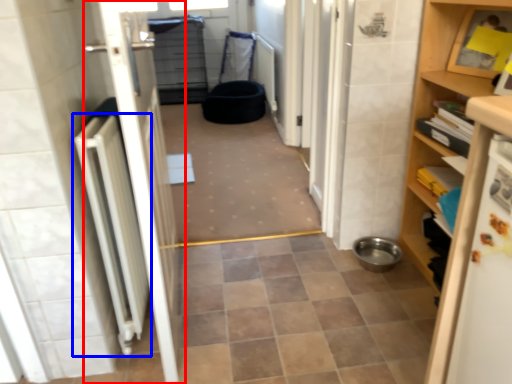
Question: Among these objects, which one is farthest to the camera, door (highlighted by a red box) or radiator (highlighted by a blue box)?

Choices:
 (A) door
 (B) radiator

Answer: (B)